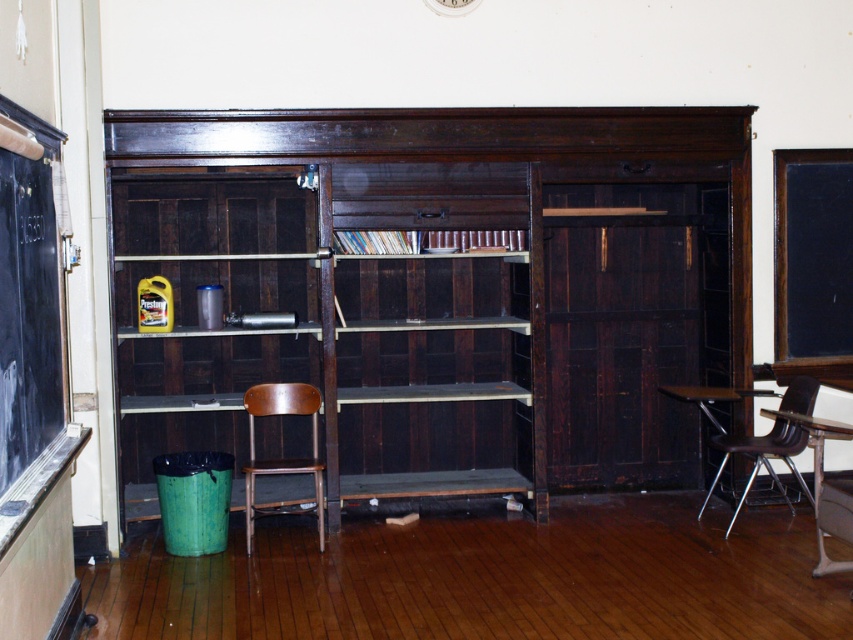
You are standing in front of the bookshelf and want to reach both the point at (811, 394) and the point at (399, 250). Which point will you need to reach first?

You will need to reach the point at (811, 394) first because it is closer to you than the point at (399, 250).

You are standing in the classroom depicted in the image. There is a point marked at coordinates (x=451, y=291). What object is located at that point?

The point at coordinates (x=451, y=291) indicates the dark wood bookshelf at center.

You are standing in front of the bookshelf and notice two points marked on the bookshelf. The first point is at coordinates point (479, 248) and the second point is at point (453, 257). Which point is closer to you?

Point (479, 248) is further to the camera than point (453, 257), so the point closer to you is point (453, 257).